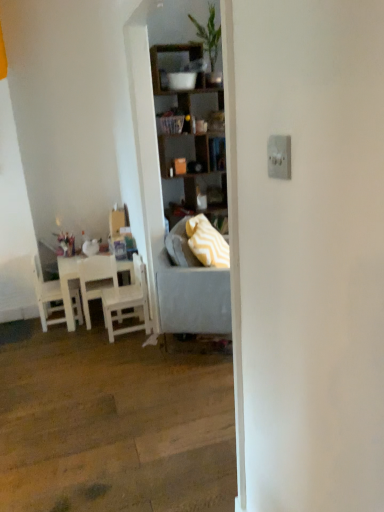
Question: Choose the correct answer: Is white matte table at left inside yellow zigzag fabric pillow at center or outside it?

Choices:
 (A) inside
 (B) outside

Answer: (B)

Question: Is point (91, 282) closer or farther from the camera than point (215, 231)?

Choices:
 (A) farther
 (B) closer

Answer: (A)

Question: Which object is positioned closest to the yellow zigzag fabric pillow at center?

Choices:
 (A) white wood chair at left, positioned as the third chair in right-to-left order
 (B) white wood chair at left, the first chair when ordered from right to left
 (C) white matte chair at left, which ranks as the 2th chair in left-to-right order
 (D) gray fabric studio couch at center
 (E) wooden shelves at center

Answer: (D)

Question: Which object is positioned closest to the white wood chair at left, which is counted as the 3th chair, starting from the left?

Choices:
 (A) yellow zigzag fabric pillow at center
 (B) white matte chair at left, placed as the 2th chair when sorted from right to left
 (C) wooden shelves at center
 (D) gray fabric studio couch at center
 (E) white matte table at left

Answer: (E)